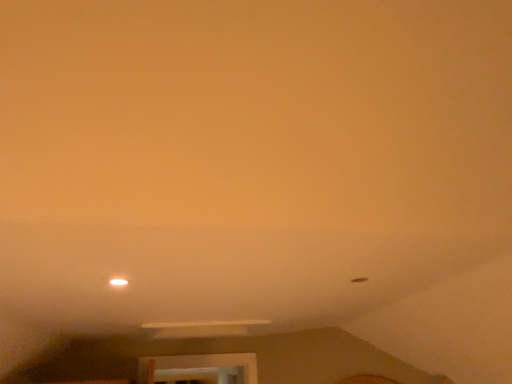
The width and height of the screenshot is (512, 384). I want to click on white matte light at upper center, so click(118, 282).

Describe the element at coordinates (118, 282) in the screenshot. This screenshot has width=512, height=384. I see `white matte light at upper center` at that location.

What is the approximate width of white matte light at upper center?

It is 2.94 inches.

At what (x,y) coordinates should I click in order to perform the action: click on white matte light at upper center. Please return your answer as a coordinate pair (x, y). This screenshot has height=384, width=512. Looking at the image, I should click on (118, 282).